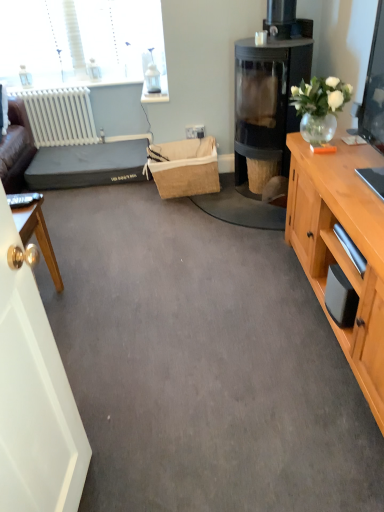
The width and height of the screenshot is (384, 512). Find the location of `vacant space underneath white glossy door at left (from a real-world perspective)`. vacant space underneath white glossy door at left (from a real-world perspective) is located at coordinates (92, 481).